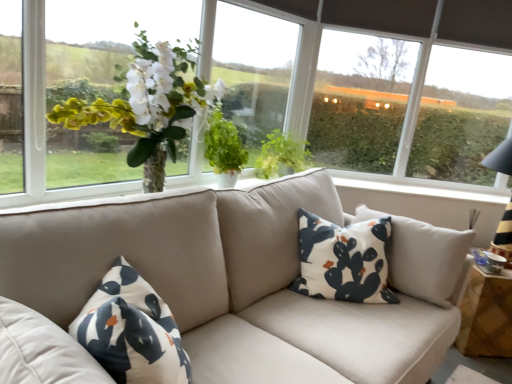
Question: Could you tell me if transparent plastic window screen at upper right, acting as the 1th window screen starting from the right, is turned towards matte glass vase at center?

Choices:
 (A) no
 (B) yes

Answer: (A)

Question: From the image's perspective, is transparent plastic window screen at upper right, the second window screen when ordered from left to right, over matte glass vase at center?

Choices:
 (A) yes
 (B) no

Answer: (A)

Question: From a real-world perspective, is transparent plastic window screen at upper right, acting as the 1th window screen starting from the right, located beneath matte glass vase at center?

Choices:
 (A) yes
 (B) no

Answer: (B)

Question: Is transparent plastic window screen at upper right, the second window screen when ordered from left to right, thinner than matte glass vase at center?

Choices:
 (A) yes
 (B) no

Answer: (A)

Question: From the image's perspective, does transparent plastic window screen at upper right, acting as the 1th window screen starting from the right, appear lower than matte glass vase at center?

Choices:
 (A) no
 (B) yes

Answer: (A)

Question: From a real-world perspective, does transparent plastic window screen at upper right, the second window screen when ordered from left to right, stand above matte glass vase at center?

Choices:
 (A) yes
 (B) no

Answer: (A)

Question: From a real-world perspective, is wooden side table at right positioned over white cotton pillow at center based on gravity?

Choices:
 (A) yes
 (B) no

Answer: (B)

Question: Is wooden side table at right at the left side of white cotton pillow at center?

Choices:
 (A) no
 (B) yes

Answer: (A)

Question: Is wooden side table at right placed right next to white cotton pillow at center?

Choices:
 (A) no
 (B) yes

Answer: (A)

Question: Is wooden side table at right to the right of white cotton pillow at center from the viewer's perspective?

Choices:
 (A) no
 (B) yes

Answer: (B)

Question: Is white cotton pillow at center at the back of wooden side table at right?

Choices:
 (A) yes
 (B) no

Answer: (B)

Question: Can you confirm if wooden side table at right is shorter than white cotton pillow at center?

Choices:
 (A) yes
 (B) no

Answer: (A)

Question: Is transparent glass window at center, placed as the first window screen when sorted from left to right, aimed at white cotton pillow at center?

Choices:
 (A) yes
 (B) no

Answer: (A)